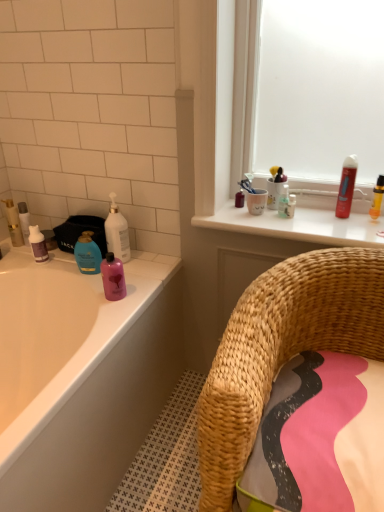
This screenshot has width=384, height=512. Find the location of `vacant space in front of matte gold lotion at left, the 6th toiletry from the right`. vacant space in front of matte gold lotion at left, the 6th toiletry from the right is located at coordinates (17, 251).